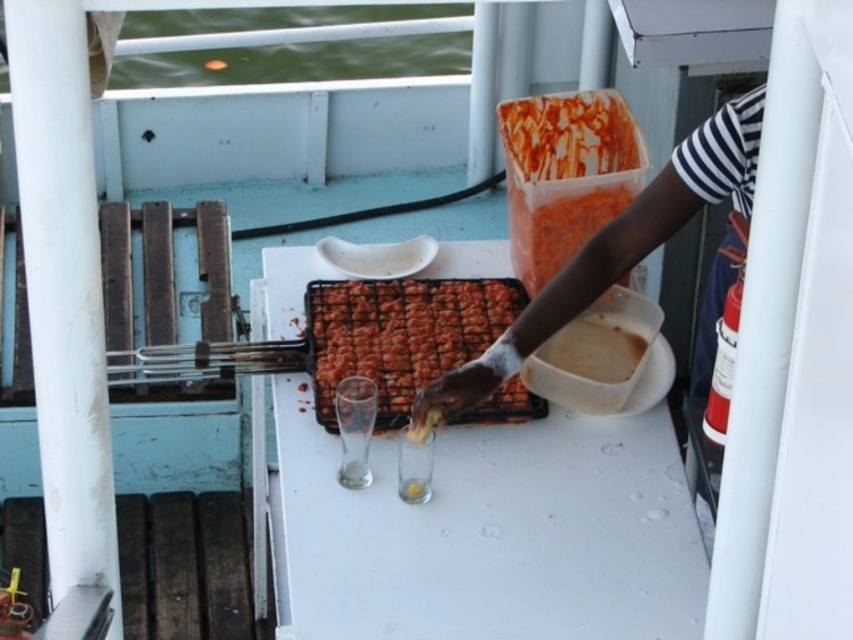
Question: Considering the relative positions of dark skin arm at center and reddish-brown crispy skewers at center in the image provided, where is dark skin arm at center located with respect to reddish-brown crispy skewers at center?

Choices:
 (A) right
 (B) left

Answer: (A)

Question: Among these points, which one is nearest to the camera?

Choices:
 (A) (728, 180)
 (B) (314, 397)

Answer: (A)

Question: Which object appears farthest from the camera in this image?

Choices:
 (A) white matte plastic container at center-right
 (B) dark skin arm at center
 (C) reddish-brown crispy skewers at center

Answer: (A)

Question: Based on their relative distances, which object is farther from the reddish-brown crispy skewers at center?

Choices:
 (A) matte plastic container at upper center
 (B) white matte plastic container at center-right

Answer: (A)

Question: Does reddish-brown crispy skewers at center have a smaller size compared to matte plastic container at upper center?

Choices:
 (A) no
 (B) yes

Answer: (A)

Question: Is dark skin arm at center wider than matte plastic container at upper center?

Choices:
 (A) yes
 (B) no

Answer: (A)